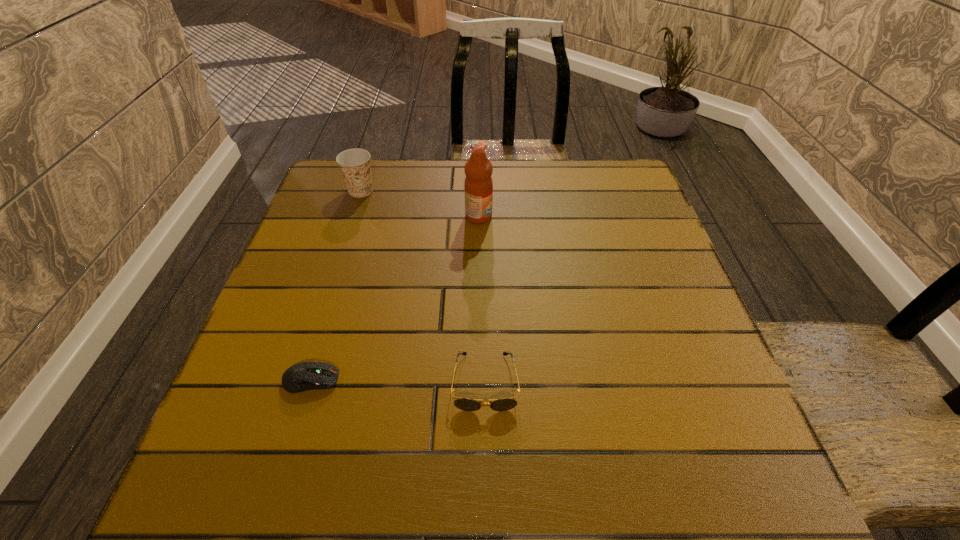
You are a GUI agent. You are given a task and a screenshot of the screen. Output one action in this format:
    pyautogui.click(x=<x>, y=<y>)
    Task: Click on the vacant area between the second tallest object and the second farthest object
    This screenshot has height=540, width=960.
    Given the screenshot: What is the action you would take?
    pyautogui.click(x=420, y=204)

At what (x,y) coordinates should I click in order to perform the action: click on vacant point located between the farthest object and the tallest object. Please return your answer as a coordinate pair (x, y). Image resolution: width=960 pixels, height=540 pixels. Looking at the image, I should click on (420, 204).

Identify the location of vacant space in between the shortest object and the farthest object. (336, 285).

At what (x,y) coordinates should I click in order to perform the action: click on free area in between the sunglasses and the third nearest object. Please return your answer as a coordinate pair (x, y). This screenshot has width=960, height=540. Looking at the image, I should click on (482, 299).

You are a GUI agent. You are given a task and a screenshot of the screen. Output one action in this format:
    pyautogui.click(x=<x>, y=<y>)
    Task: Click on the vacant region between the fruit juice and the Dixie cup
    This screenshot has height=540, width=960.
    Given the screenshot: What is the action you would take?
    (x=420, y=204)

Find the location of a particular element. This screenshot has width=960, height=540. vacant area that lies between the fruit juice and the sunglasses is located at coordinates (482, 299).

The height and width of the screenshot is (540, 960). Identify the location of vacant point located between the fruit juice and the farthest object. (420, 204).

Find the location of a particular element. This screenshot has width=960, height=540. vacant space that's between the farthest object and the shortest object is located at coordinates (336, 285).

Locate an element on the screen. This screenshot has width=960, height=540. free space between the third tallest object and the shortest object is located at coordinates (398, 381).

This screenshot has width=960, height=540. In order to click on unoccupied position between the Dixie cup and the tallest object in this screenshot , I will do `click(420, 204)`.